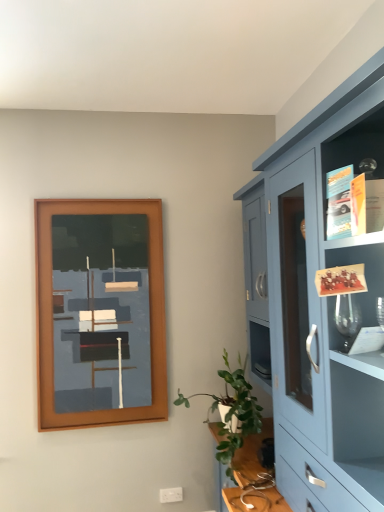
Question: From a real-world perspective, is brown wooden picture frame at upper left positioned under green leafy plant at lower right based on gravity?

Choices:
 (A) no
 (B) yes

Answer: (A)

Question: Is brown wooden picture frame at upper left oriented towards green leafy plant at lower right?

Choices:
 (A) yes
 (B) no

Answer: (B)

Question: From the image's perspective, would you say brown wooden picture frame at upper left is positioned over green leafy plant at lower right?

Choices:
 (A) yes
 (B) no

Answer: (A)

Question: Is brown wooden picture frame at upper left bigger than green leafy plant at lower right?

Choices:
 (A) yes
 (B) no

Answer: (B)

Question: Is brown wooden picture frame at upper left looking in the opposite direction of green leafy plant at lower right?

Choices:
 (A) no
 (B) yes

Answer: (A)

Question: Can you confirm if brown wooden picture frame at upper left is taller than green leafy plant at lower right?

Choices:
 (A) no
 (B) yes

Answer: (B)

Question: From the image's perspective, is matte blue cabinet at right beneath green leafy plant at lower right?

Choices:
 (A) yes
 (B) no

Answer: (B)

Question: Is matte blue cabinet at right positioned with its back to green leafy plant at lower right?

Choices:
 (A) yes
 (B) no

Answer: (A)

Question: Is matte blue cabinet at right located outside green leafy plant at lower right?

Choices:
 (A) no
 (B) yes

Answer: (B)

Question: Does matte blue cabinet at right come behind green leafy plant at lower right?

Choices:
 (A) no
 (B) yes

Answer: (A)

Question: Can you confirm if matte blue cabinet at right is shorter than green leafy plant at lower right?

Choices:
 (A) no
 (B) yes

Answer: (A)

Question: From a real-world perspective, is matte blue cabinet at right physically above green leafy plant at lower right?

Choices:
 (A) no
 (B) yes

Answer: (B)

Question: From a real-world perspective, is green leafy plant at lower right positioned under brown wooden picture frame at upper left based on gravity?

Choices:
 (A) yes
 (B) no

Answer: (A)